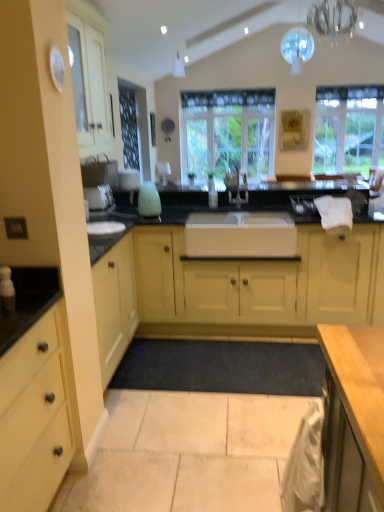
Find the location of a particular element. This screenshot has width=384, height=512. clear glass window at upper right, acting as the 2th window starting from the left is located at coordinates (348, 128).

What do you see at coordinates (228, 132) in the screenshot? I see `clear glass window at center, which is the second window in right-to-left order` at bounding box center [228, 132].

What are the coordinates of `matte yellow cabinet at left, the 1th cabinetry when ordered from front to back` in the screenshot? It's located at pyautogui.click(x=35, y=417).

How much space does clear glass chandelier at upper center, the 2th light fixture viewed from the back, occupy vertically?

The height of clear glass chandelier at upper center, the 2th light fixture viewed from the back, is 20.51 inches.

Consider the image. What is the approximate height of white glossy faucet at center?

It is 30.16 centimeters.

Describe the element at coordinates (222, 367) in the screenshot. I see `dark gray carpet at center` at that location.

Locate an element on the screen. The image size is (384, 512). clear glass window at upper right, marked as the first window in a right-to-left arrangement is located at coordinates (348, 128).

Is matte yellow cabinet at left, the second cabinetry in the back-to-front sequence, positioned beyond the bounds of transparent glass sphere at upper center, the 1th light fixture positioned from the top?

Yes, matte yellow cabinet at left, the second cabinetry in the back-to-front sequence, is outside of transparent glass sphere at upper center, the 1th light fixture positioned from the top.

Which object is positioned more to the right, matte yellow cabinet at left, the 1th cabinetry when ordered from front to back, or transparent glass sphere at upper center, the 2th light fixture positioned from the bottom?

transparent glass sphere at upper center, the 2th light fixture positioned from the bottom, is more to the right.

Could you tell me if matte yellow cabinet at left, the second cabinetry in the back-to-front sequence, is turned towards transparent glass sphere at upper center, acting as the 1th light fixture starting from the back?

No.

From a real-world perspective, is transparent glass sphere at upper center, the 1th light fixture positioned from the top, on clear glass window at upper right, acting as the 2th window starting from the left?

Correct, in the physical world, transparent glass sphere at upper center, the 1th light fixture positioned from the top, is higher than clear glass window at upper right, acting as the 2th window starting from the left.

From the image's perspective, is transparent glass sphere at upper center, positioned as the second light fixture in front-to-back order, over clear glass window at upper right, marked as the first window in a right-to-left arrangement?

Correct, transparent glass sphere at upper center, positioned as the second light fixture in front-to-back order, appears higher than clear glass window at upper right, marked as the first window in a right-to-left arrangement, in the image.

Consider the image. Are transparent glass sphere at upper center, acting as the 1th light fixture starting from the back, and clear glass window at upper right, marked as the first window in a right-to-left arrangement, far apart?

Yes, transparent glass sphere at upper center, acting as the 1th light fixture starting from the back, and clear glass window at upper right, marked as the first window in a right-to-left arrangement, are quite far apart.

Can you confirm if transparent glass sphere at upper center, the 2th light fixture positioned from the bottom, is wider than clear glass window at upper right, marked as the first window in a right-to-left arrangement?

Yes, transparent glass sphere at upper center, the 2th light fixture positioned from the bottom, is wider than clear glass window at upper right, marked as the first window in a right-to-left arrangement.

Is matte yellow cabinets at center, acting as the second cabinetry starting from the front, located within clear glass window at upper right, acting as the 2th window starting from the left?

That's incorrect, matte yellow cabinets at center, acting as the second cabinetry starting from the front, is not inside clear glass window at upper right, acting as the 2th window starting from the left.

Is clear glass window at upper right, acting as the 2th window starting from the left, taller or shorter than matte yellow cabinets at center, acting as the second cabinetry starting from the front?

Clearly, clear glass window at upper right, acting as the 2th window starting from the left, is taller compared to matte yellow cabinets at center, acting as the second cabinetry starting from the front.

Considering the positions of objects clear glass window at upper right, marked as the first window in a right-to-left arrangement, and matte yellow cabinets at center, acting as the second cabinetry starting from the front, in the image provided, who is more to the right, clear glass window at upper right, marked as the first window in a right-to-left arrangement, or matte yellow cabinets at center, acting as the second cabinetry starting from the front,?

From the viewer's perspective, clear glass window at upper right, marked as the first window in a right-to-left arrangement, appears more on the right side.

Is clear glass chandelier at upper center, which ranks as the second light fixture in top-to-bottom order, to the left of transparent glass sphere at upper center, acting as the 1th light fixture starting from the back, from the viewer's perspective?

Indeed, clear glass chandelier at upper center, which ranks as the second light fixture in top-to-bottom order, is positioned on the left side of transparent glass sphere at upper center, acting as the 1th light fixture starting from the back.

Looking at the image, does clear glass chandelier at upper center, acting as the 1th light fixture starting from the bottom, seem bigger or smaller compared to transparent glass sphere at upper center, acting as the 1th light fixture starting from the back?

In the image, clear glass chandelier at upper center, acting as the 1th light fixture starting from the bottom, appears to be larger than transparent glass sphere at upper center, acting as the 1th light fixture starting from the back.

From the image's perspective, is clear glass chandelier at upper center, which ranks as the second light fixture in top-to-bottom order, above or below transparent glass sphere at upper center, positioned as the second light fixture in front-to-back order?

clear glass chandelier at upper center, which ranks as the second light fixture in top-to-bottom order, is situated lower than transparent glass sphere at upper center, positioned as the second light fixture in front-to-back order, in the image.

From a real-world perspective, is clear glass chandelier at upper center, marked as the 1th light fixture in a front-to-back arrangement, physically located above or below matte yellow cabinets at center, acting as the second cabinetry starting from the front?

clear glass chandelier at upper center, marked as the 1th light fixture in a front-to-back arrangement, is above matte yellow cabinets at center, acting as the second cabinetry starting from the front.

Can you confirm if clear glass chandelier at upper center, marked as the 1th light fixture in a front-to-back arrangement, is smaller than matte yellow cabinets at center, acting as the second cabinetry starting from the front?

Yes, clear glass chandelier at upper center, marked as the 1th light fixture in a front-to-back arrangement, is smaller than matte yellow cabinets at center, acting as the second cabinetry starting from the front.

How many degrees apart are the facing directions of clear glass chandelier at upper center, which ranks as the second light fixture in top-to-bottom order, and matte yellow cabinets at center, which appears as the first cabinetry when viewed from the back?

The angular difference between clear glass chandelier at upper center, which ranks as the second light fixture in top-to-bottom order, and matte yellow cabinets at center, which appears as the first cabinetry when viewed from the back, is 179 degrees.

From the image's perspective, starting from the clear glass chandelier at upper center, marked as the 1th light fixture in a front-to-back arrangement, which cabinetry is the 1st one below? Please provide its 2D coordinates.

[(233, 289)]

Considering the sizes of objects white glossy faucet at center and transparent glass sphere at upper center, acting as the 1th light fixture starting from the back, in the image provided, who is shorter, white glossy faucet at center or transparent glass sphere at upper center, acting as the 1th light fixture starting from the back,?

white glossy faucet at center.

Consider the image. Considering the relative sizes of white glossy faucet at center and transparent glass sphere at upper center, the 1th light fixture positioned from the top, in the image provided, is white glossy faucet at center thinner than transparent glass sphere at upper center, the 1th light fixture positioned from the top,?

In fact, white glossy faucet at center might be wider than transparent glass sphere at upper center, the 1th light fixture positioned from the top.

Considering the positions of point (245, 190) and point (284, 42), is point (245, 190) closer or farther from the camera than point (284, 42)?

Clearly, point (245, 190) is more distant from the camera than point (284, 42).

Considering the relative positions of white glossy faucet at center and transparent glass sphere at upper center, positioned as the second light fixture in front-to-back order, in the image provided, is white glossy faucet at center to the left of transparent glass sphere at upper center, positioned as the second light fixture in front-to-back order, from the viewer's perspective?

Indeed, white glossy faucet at center is positioned on the left side of transparent glass sphere at upper center, positioned as the second light fixture in front-to-back order.

Is white glossy faucet at center facing towards dark gray carpet at center?

No, white glossy faucet at center is not turned towards dark gray carpet at center.

Does white glossy faucet at center have a lesser height compared to dark gray carpet at center?

Incorrect, the height of white glossy faucet at center does not fall short of that of dark gray carpet at center.

Is white glossy faucet at center in front of dark gray carpet at center?

No, white glossy faucet at center is behind dark gray carpet at center.

From a real-world perspective, count 2nd cabinetrys downward from the transparent glass sphere at upper center, the 1th light fixture positioned from the top, and point to it. Please provide its 2D coordinates.

[(35, 417)]

This screenshot has width=384, height=512. Find the location of `the 2nd light fixture located above the clear glass window at upper right, marked as the first window in a right-to-left arrangement (from a real-world perspective)`. the 2nd light fixture located above the clear glass window at upper right, marked as the first window in a right-to-left arrangement (from a real-world perspective) is located at coordinates (297, 48).

Looking at the image, which one is located closer to clear glass window at upper right, acting as the 2th window starting from the left, white glossy faucet at center or clear glass window at center, which is counted as the 1th window, starting from the left?

clear glass window at center, which is counted as the 1th window, starting from the left, is positioned closer to the anchor clear glass window at upper right, acting as the 2th window starting from the left.

Based on their spatial positions, is matte yellow cabinet at left, the second cabinetry in the back-to-front sequence, or white glossy faucet at center closer to dark gray carpet at center?

The object closer to dark gray carpet at center is matte yellow cabinet at left, the second cabinetry in the back-to-front sequence.

Which object lies nearer to the anchor point dark gray carpet at center, clear glass window at center, which is counted as the 1th window, starting from the left, or clear glass chandelier at upper center, the 2th light fixture viewed from the back?

clear glass window at center, which is counted as the 1th window, starting from the left.

Based on their spatial positions, is clear glass window at upper right, acting as the 2th window starting from the left, or white glossy faucet at center closer to transparent glass sphere at upper center, the 2th light fixture positioned from the bottom?

white glossy faucet at center.

Estimate the real-world distances between objects in this image. Which object is further from white glossy faucet at center, clear glass chandelier at upper center, the 2th light fixture viewed from the back, or clear glass window at center, which is counted as the 1th window, starting from the left?

clear glass window at center, which is counted as the 1th window, starting from the left, lies further to white glossy faucet at center than the other object.

Estimate the real-world distances between objects in this image. Which object is further from white glossy faucet at center, clear glass window at center, which is counted as the 1th window, starting from the left, or transparent glass sphere at upper center, positioned as the second light fixture in front-to-back order?

clear glass window at center, which is counted as the 1th window, starting from the left, is positioned further to the anchor white glossy faucet at center.

Looking at the image, which one is located further to clear glass window at center, which is counted as the 1th window, starting from the left, dark gray carpet at center or transparent glass sphere at upper center, the 2th light fixture positioned from the bottom?

Based on the image, dark gray carpet at center appears to be further to clear glass window at center, which is counted as the 1th window, starting from the left.

Estimate the real-world distances between objects in this image. Which object is further from matte yellow cabinet at left, the 1th cabinetry when ordered from front to back, clear glass window at center, which is counted as the 1th window, starting from the left, or white glossy faucet at center?

Among the two, clear glass window at center, which is counted as the 1th window, starting from the left, is located further to matte yellow cabinet at left, the 1th cabinetry when ordered from front to back.

Locate an element on the screen. The height and width of the screenshot is (512, 384). cabinetry located between matte yellow cabinet at left, the second cabinetry in the back-to-front sequence, and white glossy faucet at center in the depth direction is located at coordinates (233, 289).

You are a GUI agent. You are given a task and a screenshot of the screen. Output one action in this format:
    pyautogui.click(x=<x>, y=<y>)
    Task: Click on the light fixture positioned between white glossy faucet at center and transparent glass sphere at upper center, positioned as the second light fixture in front-to-back order, from near to far
    The width and height of the screenshot is (384, 512).
    Given the screenshot: What is the action you would take?
    point(333,17)

Identify the location of faucet between clear glass chandelier at upper center, the 2th light fixture viewed from the back, and matte yellow cabinets at center, acting as the second cabinetry starting from the front, in the vertical direction. The image size is (384, 512). (236, 187).

Locate an element on the screen. faucet between matte yellow cabinet at left, the 1th cabinetry when ordered from front to back, and transparent glass sphere at upper center, the 1th light fixture positioned from the top, in the front-back direction is located at coordinates (236, 187).